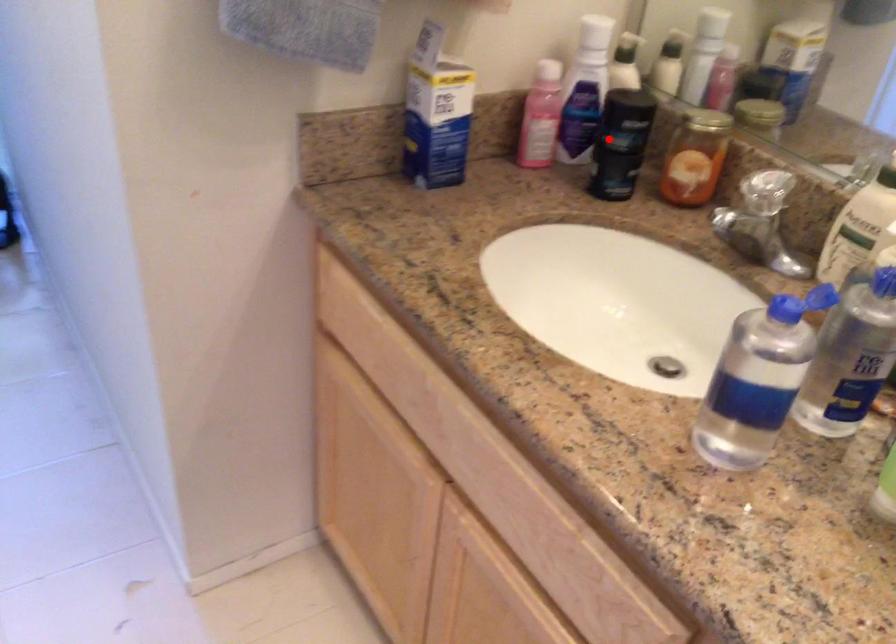
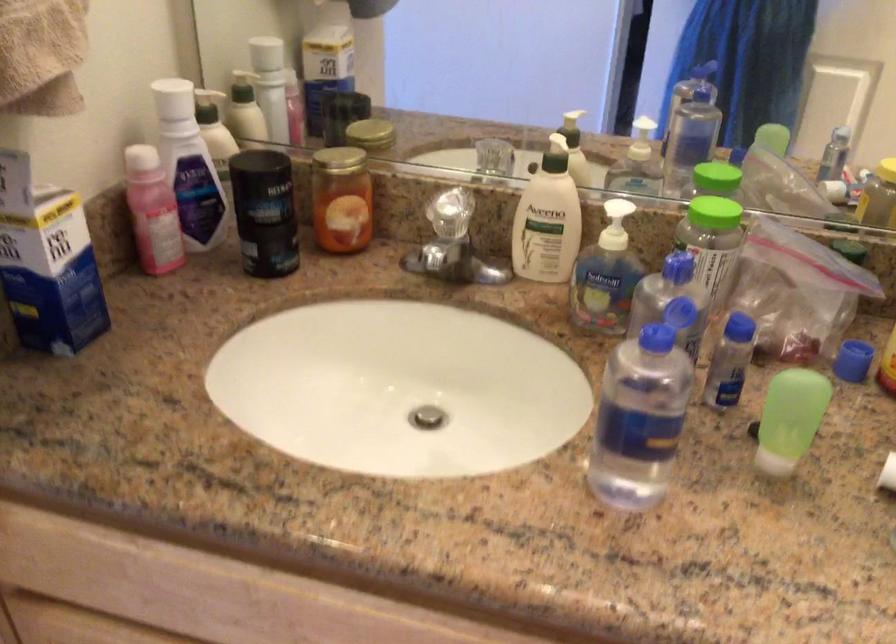
Question: A red point is marked in image1. In image2, is the corresponding 3D point closer to the camera or farther? Reply with the corresponding letter.

Choices:
 (A) The corresponding 3D point is closer.
 (B) The corresponding 3D point is farther.

Answer: (A)